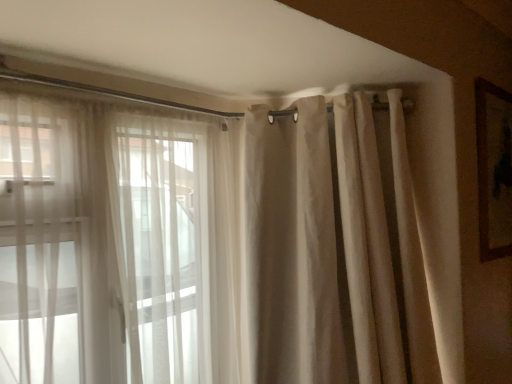
Question: Considering their positions, is sheer white curtains at left located in front of or behind brown wooden picture frame at upper right?

Choices:
 (A) behind
 (B) front

Answer: (B)

Question: Considering the positions of sheer white curtains at left and brown wooden picture frame at upper right in the image, is sheer white curtains at left taller or shorter than brown wooden picture frame at upper right?

Choices:
 (A) short
 (B) tall

Answer: (B)

Question: Which is nearer to the sheer white curtains at left?

Choices:
 (A) brown wooden picture frame at upper right
 (B) beige fabric curtain at upper right

Answer: (B)

Question: Which object is the closest to the sheer white curtains at left?

Choices:
 (A) brown wooden picture frame at upper right
 (B) beige fabric curtain at upper right

Answer: (B)